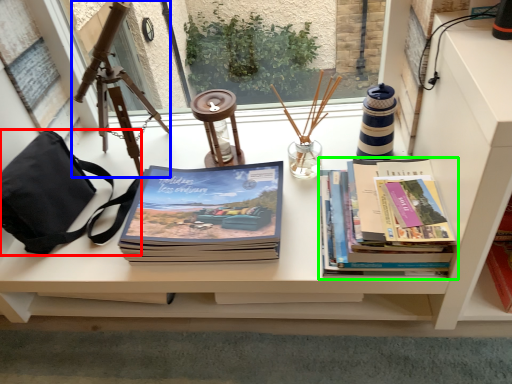
Question: Which object is positioned farthest from handbag (highlighted by a red box)? Select from tripod (highlighted by a blue box) and book (highlighted by a green box).

Choices:
 (A) tripod
 (B) book

Answer: (B)